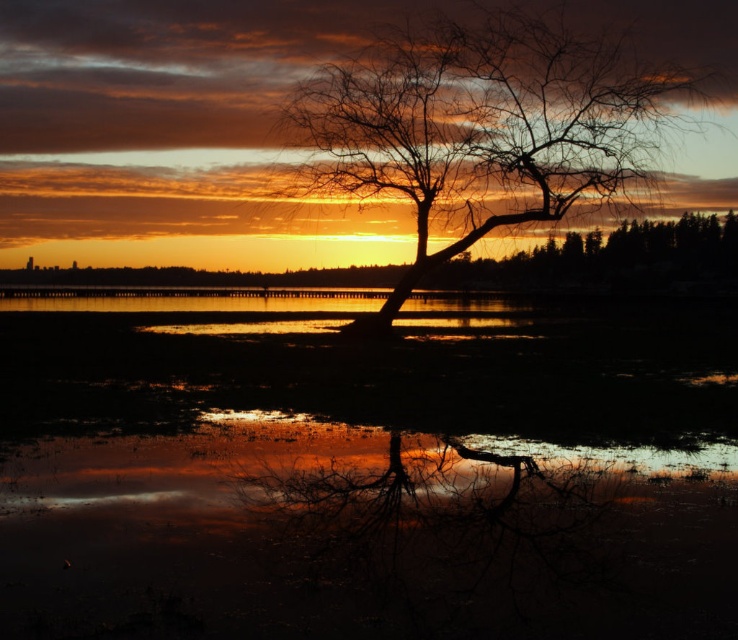
You are standing on the shore of the lake and see the translucent reflective water at center and the silhouette bark tree at center. Which object is positioned to the right of the other?

The translucent reflective water at center is to the left of the silhouette bark tree at center, so the silhouette bark tree at center is positioned to the right of the translucent reflective water at center.

You are a photographer trying to capture the sunset. You notice the translucent reflective water at center and the silhouette bark tree at center. Which object appears taller in the photo?

The silhouette bark tree at center appears taller than the translucent reflective water at center in the photo.